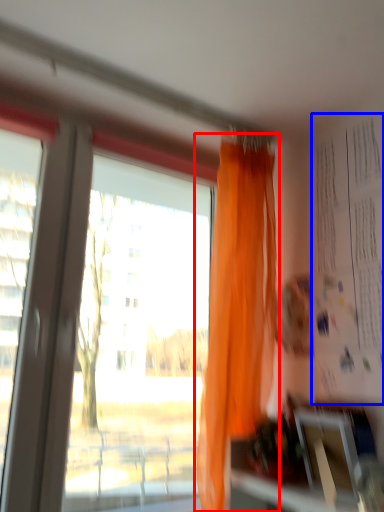
Question: Which object appears farthest to the camera in this image, curtain (highlighted by a red box) or bulletin board (highlighted by a blue box)?

Choices:
 (A) curtain
 (B) bulletin board

Answer: (A)